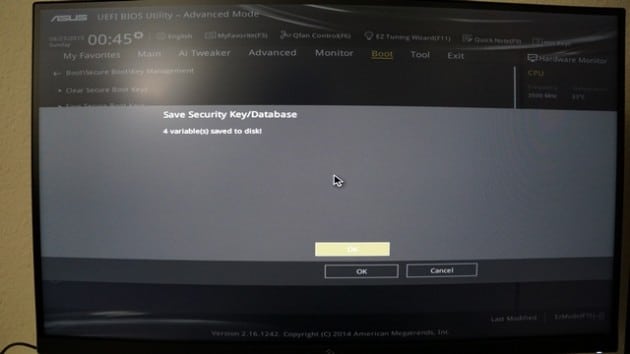
I want to click on corners, so click(49, 343), click(615, 344), click(617, 18), click(38, 9).